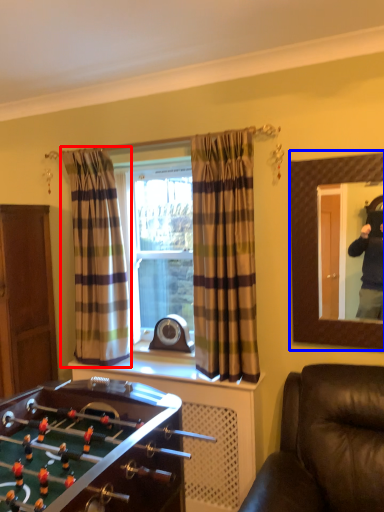
Question: Among these objects, which one is farthest to the camera, curtain (highlighted by a red box) or mirror (highlighted by a blue box)?

Choices:
 (A) curtain
 (B) mirror

Answer: (A)